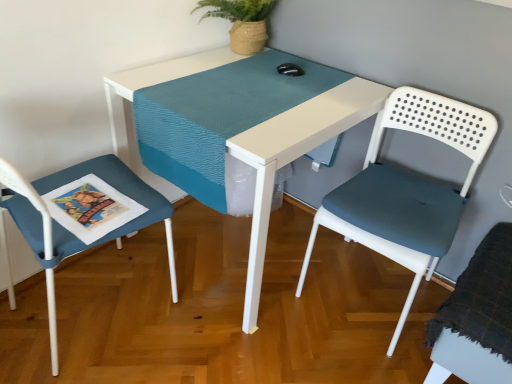
Locate an element on the screen. vacant space in white plastic table at center (from a real-world perspective) is located at coordinates (234, 244).